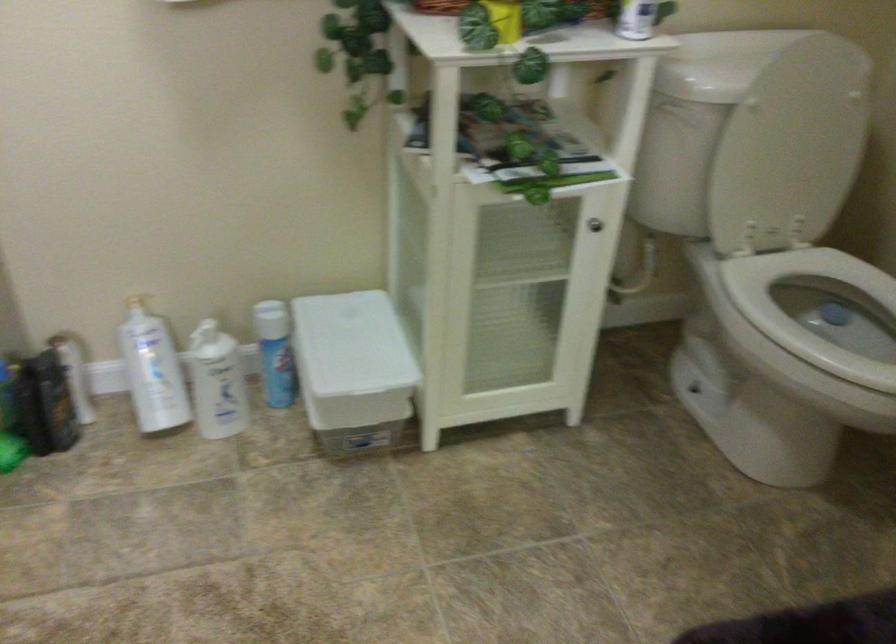
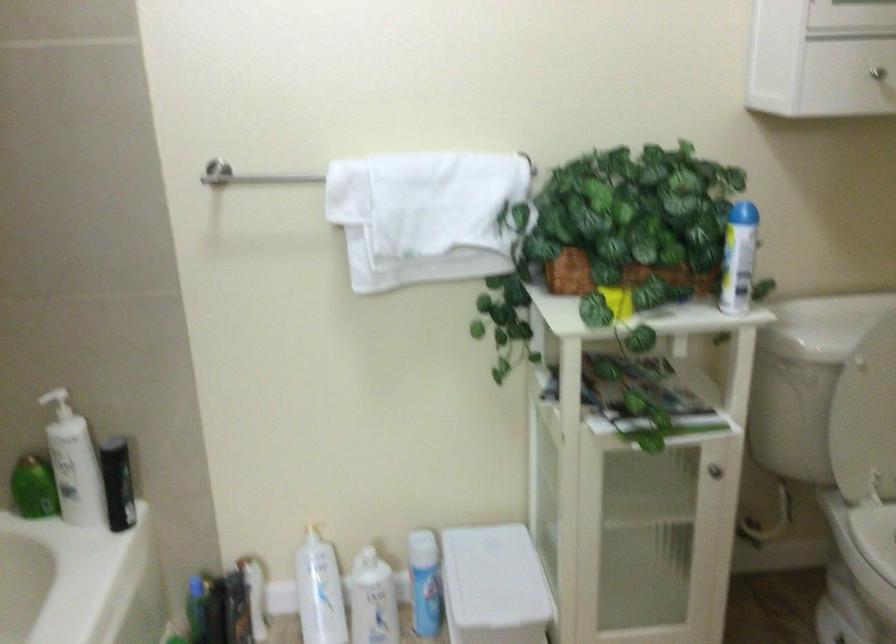
In the second image, find the point that corresponds to point 154,368 in the first image.

(319, 591)